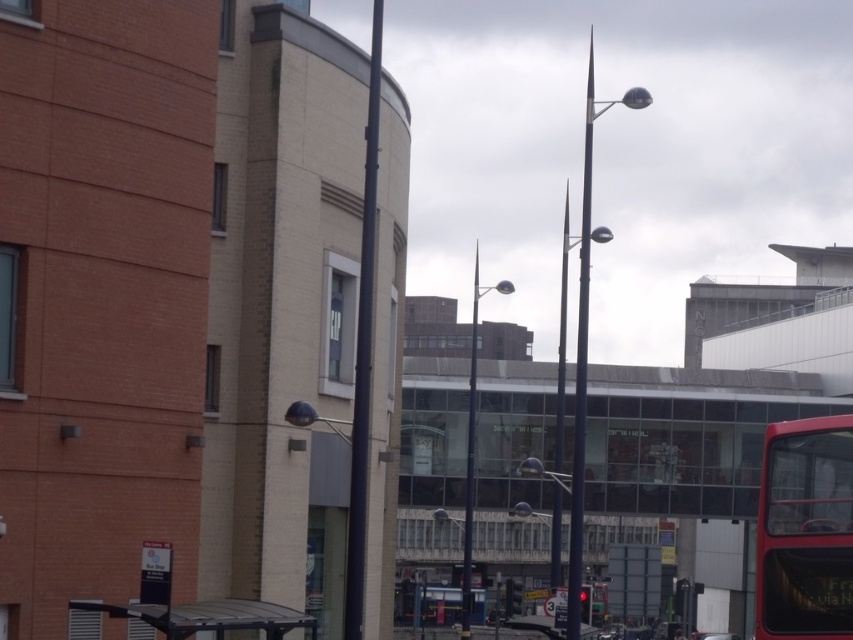
Question: Is red matte bus at right to the right of metallic gray bus stop at lower left from the viewer's perspective?

Choices:
 (A) yes
 (B) no

Answer: (A)

Question: Which point is farther to the camera?

Choices:
 (A) (189, 634)
 (B) (770, 609)

Answer: (A)

Question: Which object appears farthest from the camera in this image?

Choices:
 (A) red matte bus at right
 (B) metallic gray bus stop at lower left

Answer: (B)

Question: Does red matte bus at right have a lesser width compared to metallic gray bus stop at lower left?

Choices:
 (A) yes
 (B) no

Answer: (A)

Question: Can you confirm if red matte bus at right is bigger than metallic gray bus stop at lower left?

Choices:
 (A) yes
 (B) no

Answer: (A)

Question: Which object is closer to the camera taking this photo?

Choices:
 (A) metallic gray bus stop at lower left
 (B) red matte bus at right

Answer: (B)